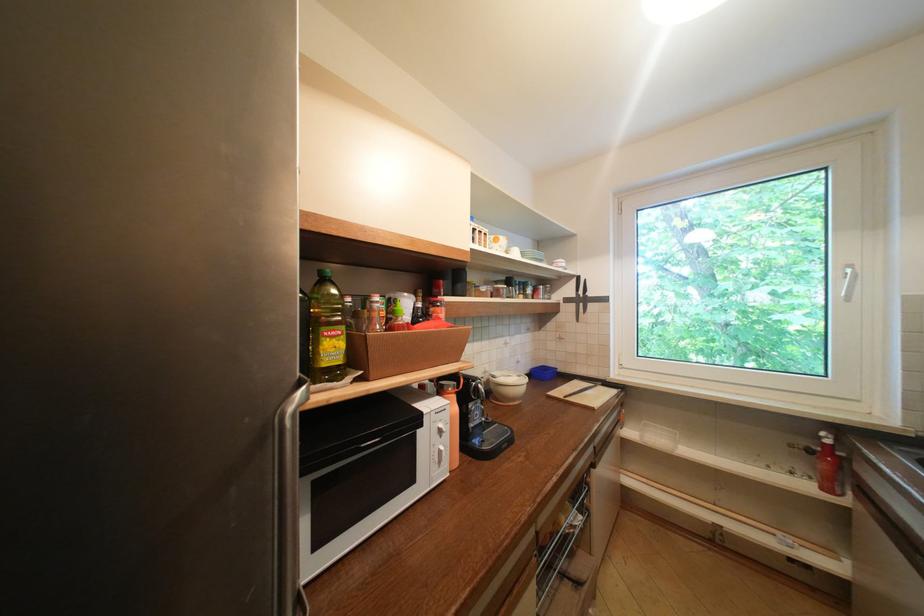
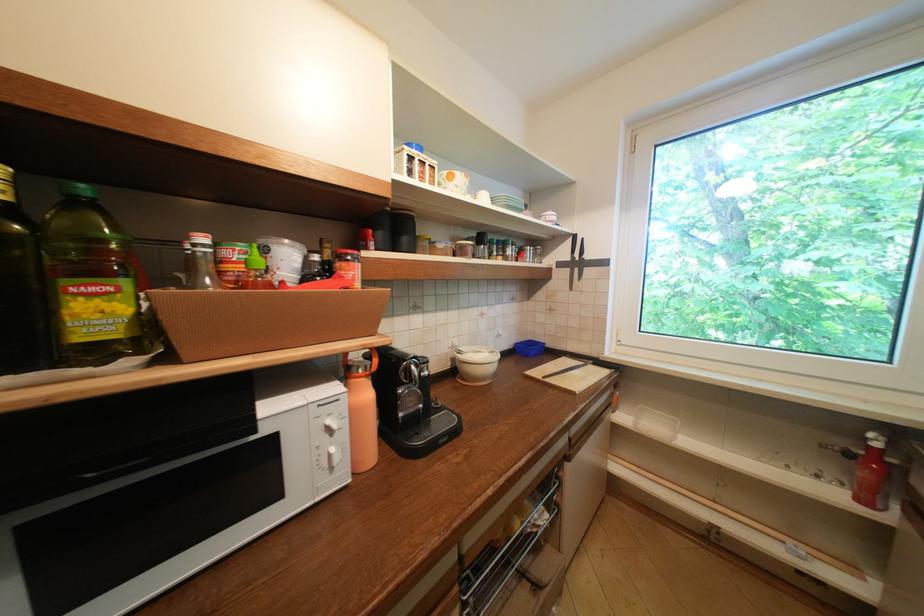
The images are taken continuously from a first-person perspective. In which direction are you moving?

The movement direction of the cameraman is right, forward.